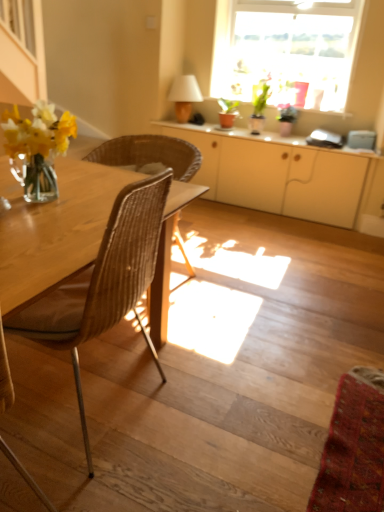
Where is `free space above wooden stairs at lower left (from a real-world perspective)`? free space above wooden stairs at lower left (from a real-world perspective) is located at coordinates (238, 318).